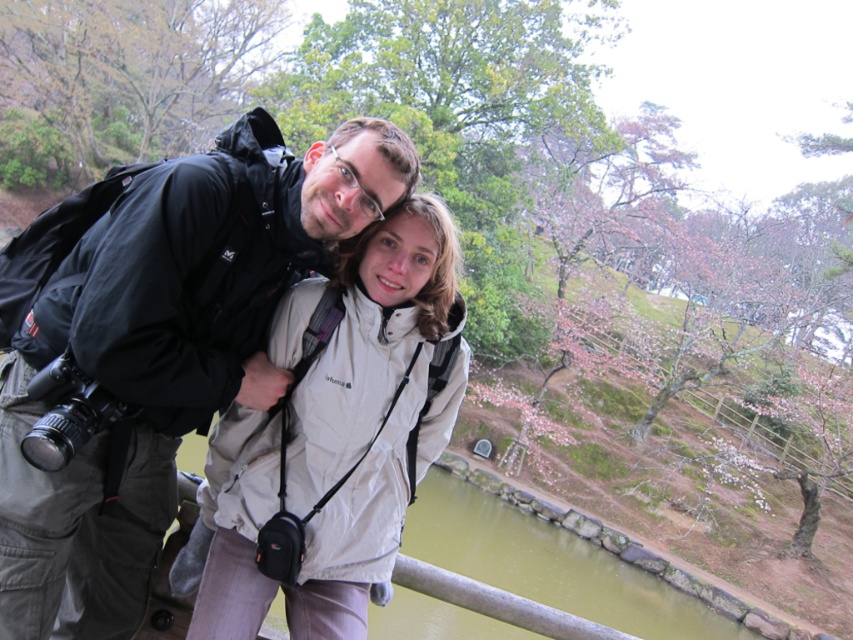
Question: In this image, where is matte black jacket at left located relative to white matte jacket at center?

Choices:
 (A) left
 (B) right

Answer: (A)

Question: Does matte black jacket at left appear under white matte jacket at center?

Choices:
 (A) no
 (B) yes

Answer: (A)

Question: Does matte black jacket at left have a lesser width compared to white matte jacket at center?

Choices:
 (A) yes
 (B) no

Answer: (B)